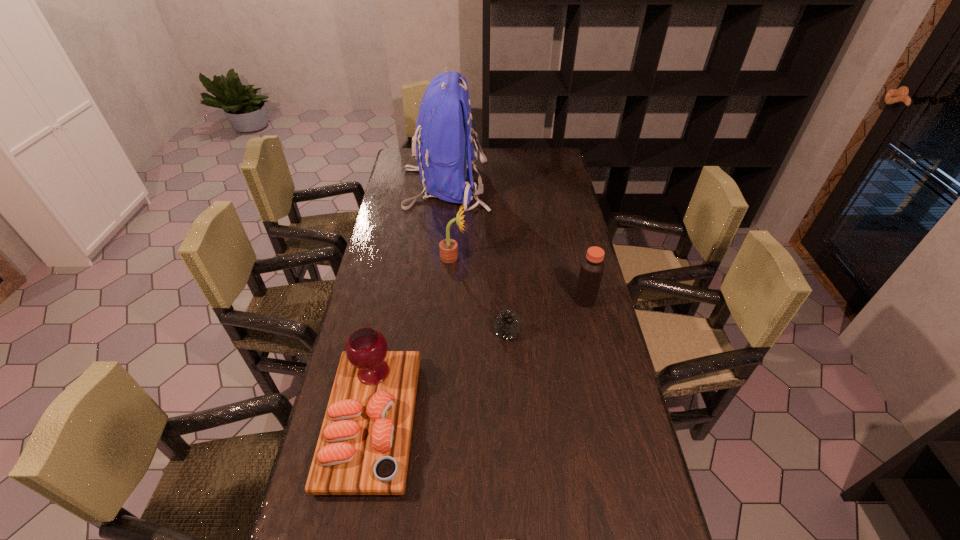
The width and height of the screenshot is (960, 540). What are the coordinates of `free space that satisfies the following two spatial constraints: 1. on the back of the tallest object; 2. on the back side of the pinecone` in the screenshot? It's located at (431, 333).

Where is `free space that satisfies the following two spatial constraints: 1. on the back side of the rightmost object; 2. on the right side of the second nearest object`? The image size is (960, 540). free space that satisfies the following two spatial constraints: 1. on the back side of the rightmost object; 2. on the right side of the second nearest object is located at coordinates (505, 300).